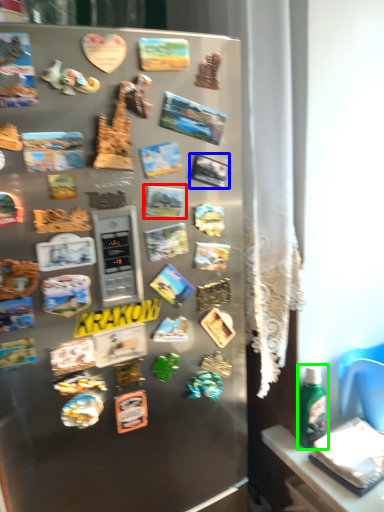
Question: Which object is the farthest from comic book (highlighted by a red box)? Choose among these: comic book (highlighted by a blue box) or bottle (highlighted by a green box).

Choices:
 (A) comic book
 (B) bottle

Answer: (B)